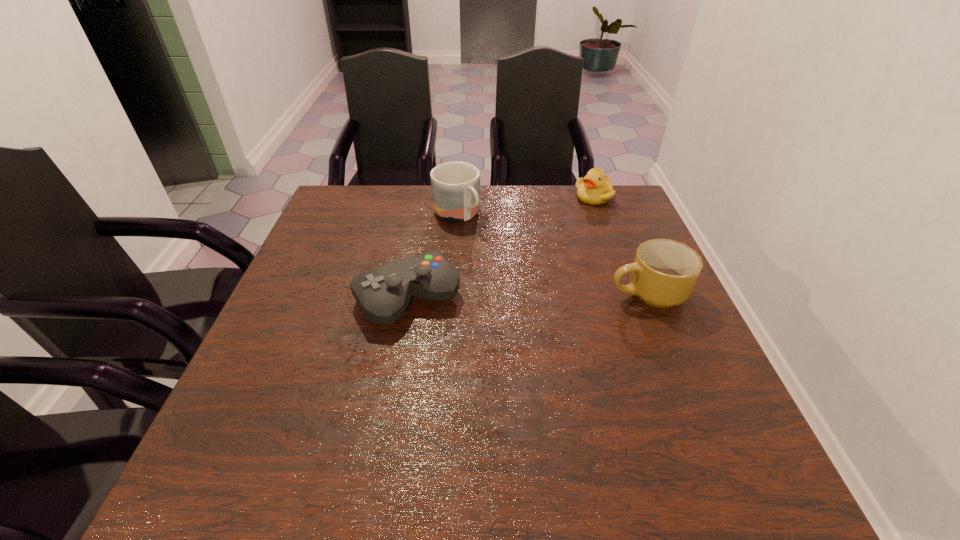
Where is `free space between the shorter mug and the tallest object`? The image size is (960, 540). free space between the shorter mug and the tallest object is located at coordinates (552, 254).

At what (x,y) coordinates should I click in order to perform the action: click on free space between the nearer mug and the tallest object. Please return your answer as a coordinate pair (x, y). The image size is (960, 540). Looking at the image, I should click on tap(552, 254).

This screenshot has width=960, height=540. Find the location of `vacant space in between the taller mug and the right mug`. vacant space in between the taller mug and the right mug is located at coordinates (552, 254).

Point out which object is positioned as the third nearest to the duckling. Please provide its 2D coordinates. Your answer should be formatted as a tuple, i.e. [(x, y)], where the tuple contains the x and y coordinates of a point satisfying the conditions above.

[(383, 294)]

The height and width of the screenshot is (540, 960). In order to click on the third closest object to the control in this screenshot , I will do `click(595, 188)`.

The height and width of the screenshot is (540, 960). Find the location of `vacant space that satisfies the following two spatial constraints: 1. on the front side of the farther mug; 2. on the side with the handle of the shorter mug`. vacant space that satisfies the following two spatial constraints: 1. on the front side of the farther mug; 2. on the side with the handle of the shorter mug is located at coordinates (451, 293).

Identify the location of free spot that satisfies the following two spatial constraints: 1. on the back side of the shorter mug; 2. on the side with the handle of the control. (409, 293).

The width and height of the screenshot is (960, 540). Find the location of `free location that satisfies the following two spatial constraints: 1. on the back side of the right mug; 2. on the side with the handle of the control`. free location that satisfies the following two spatial constraints: 1. on the back side of the right mug; 2. on the side with the handle of the control is located at coordinates (409, 293).

I want to click on vacant area that satisfies the following two spatial constraints: 1. on the back side of the farther mug; 2. on the left side of the duckling, so click(458, 197).

Where is `vacant space that satisfies the following two spatial constraints: 1. on the front side of the left mug; 2. on the side with the handle of the shorter mug`? The width and height of the screenshot is (960, 540). vacant space that satisfies the following two spatial constraints: 1. on the front side of the left mug; 2. on the side with the handle of the shorter mug is located at coordinates (451, 293).